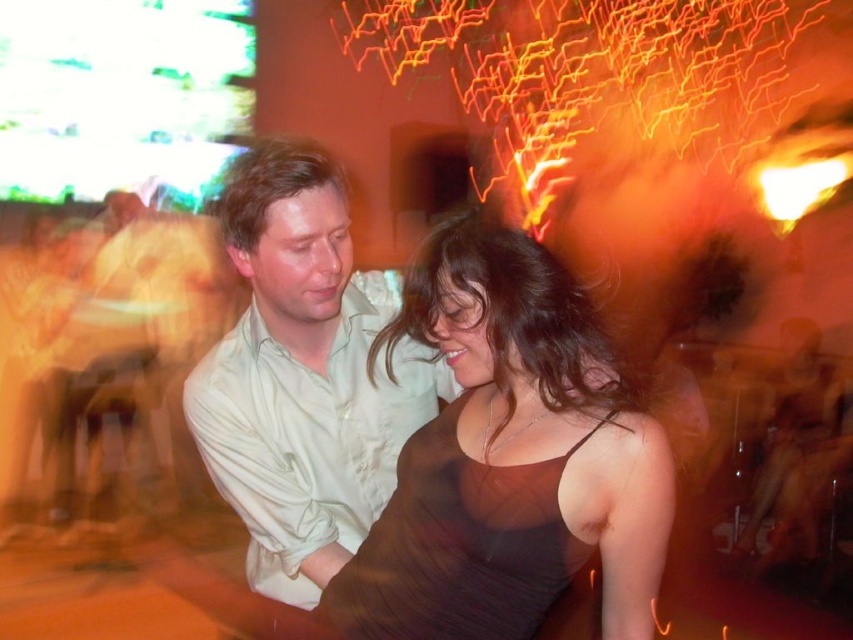
Question: Is brown satin dress at center above light beige shirt at center?

Choices:
 (A) no
 (B) yes

Answer: (A)

Question: Among these points, which one is farthest from the camera?

Choices:
 (A) (282, 504)
 (B) (474, 538)

Answer: (A)

Question: Among these points, which one is farthest from the camera?

Choices:
 (A) (241, 396)
 (B) (456, 419)

Answer: (A)

Question: Does brown satin dress at center appear on the left side of light beige shirt at center?

Choices:
 (A) yes
 (B) no

Answer: (B)

Question: Does brown satin dress at center have a smaller size compared to light beige shirt at center?

Choices:
 (A) no
 (B) yes

Answer: (B)